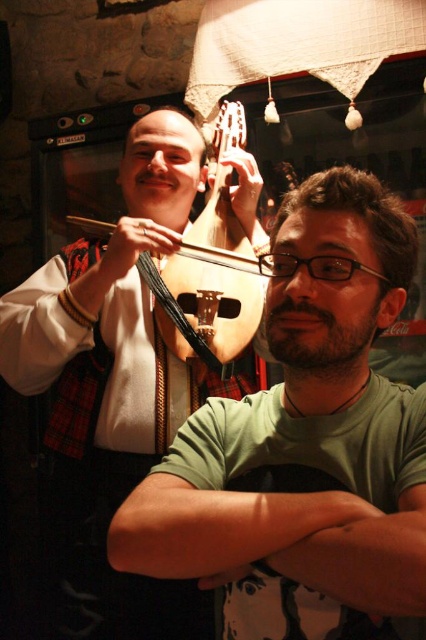
Question: Can you confirm if green matte shirt at center is thinner than matte black guitar at left?

Choices:
 (A) yes
 (B) no

Answer: (A)

Question: Is green matte shirt at center bigger than matte black guitar at left?

Choices:
 (A) no
 (B) yes

Answer: (A)

Question: Which of the following is the farthest from the observer?

Choices:
 (A) wooden cello at upper center
 (B) green matte shirt at center

Answer: (A)

Question: Which point is closer to the camera taking this photo?

Choices:
 (A) (124, 237)
 (B) (325, 371)

Answer: (B)

Question: Which of these objects is positioned closest to the matte black guitar at left?

Choices:
 (A) wooden cello at upper center
 (B) green matte shirt at center

Answer: (A)

Question: Can you confirm if green matte shirt at center is positioned to the left of wooden cello at upper center?

Choices:
 (A) no
 (B) yes

Answer: (A)